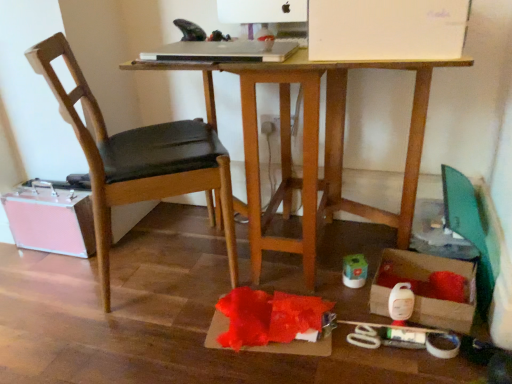
Question: Is black leather chair at left far from matte white power plugs and sockets at center?

Choices:
 (A) yes
 (B) no

Answer: (B)

Question: Is black leather chair at left outside matte white power plugs and sockets at center?

Choices:
 (A) no
 (B) yes

Answer: (B)

Question: From a real-world perspective, is black leather chair at left physically above matte white power plugs and sockets at center?

Choices:
 (A) yes
 (B) no

Answer: (A)

Question: Is black leather chair at left directly adjacent to matte white power plugs and sockets at center?

Choices:
 (A) yes
 (B) no

Answer: (B)

Question: From a real-world perspective, is black leather chair at left located beneath matte white power plugs and sockets at center?

Choices:
 (A) yes
 (B) no

Answer: (B)

Question: From their relative heights in the image, would you say black leather chair at left is taller or shorter than silver metallic laptop at upper center?

Choices:
 (A) tall
 (B) short

Answer: (A)

Question: From the image's perspective, is black leather chair at left positioned above or below silver metallic laptop at upper center?

Choices:
 (A) above
 (B) below

Answer: (B)

Question: Considering the positions of black leather chair at left and silver metallic laptop at upper center in the image, is black leather chair at left bigger or smaller than silver metallic laptop at upper center?

Choices:
 (A) big
 (B) small

Answer: (A)

Question: From a real-world perspective, relative to silver metallic laptop at upper center, is black leather chair at left vertically above or below?

Choices:
 (A) below
 (B) above

Answer: (A)

Question: Considering the relative positions of silver metallic laptop at upper center and matte white power plugs and sockets at center in the image provided, is silver metallic laptop at upper center to the left or to the right of matte white power plugs and sockets at center?

Choices:
 (A) left
 (B) right

Answer: (A)

Question: Based on their sizes in the image, would you say silver metallic laptop at upper center is bigger or smaller than matte white power plugs and sockets at center?

Choices:
 (A) small
 (B) big

Answer: (B)

Question: From a real-world perspective, is silver metallic laptop at upper center physically located above or below matte white power plugs and sockets at center?

Choices:
 (A) below
 (B) above

Answer: (B)

Question: Considering the positions of silver metallic laptop at upper center and matte white power plugs and sockets at center in the image, is silver metallic laptop at upper center wider or thinner than matte white power plugs and sockets at center?

Choices:
 (A) wide
 (B) thin

Answer: (A)

Question: From a real-world perspective, relative to wooden desk at center, is pink metallic suitcase at lower left, which is the first storage box in left-to-right order, vertically above or below?

Choices:
 (A) below
 (B) above

Answer: (A)

Question: From the image's perspective, is pink metallic suitcase at lower left, placed as the 2th storage box when sorted from right to left, located above or below wooden desk at center?

Choices:
 (A) below
 (B) above

Answer: (A)